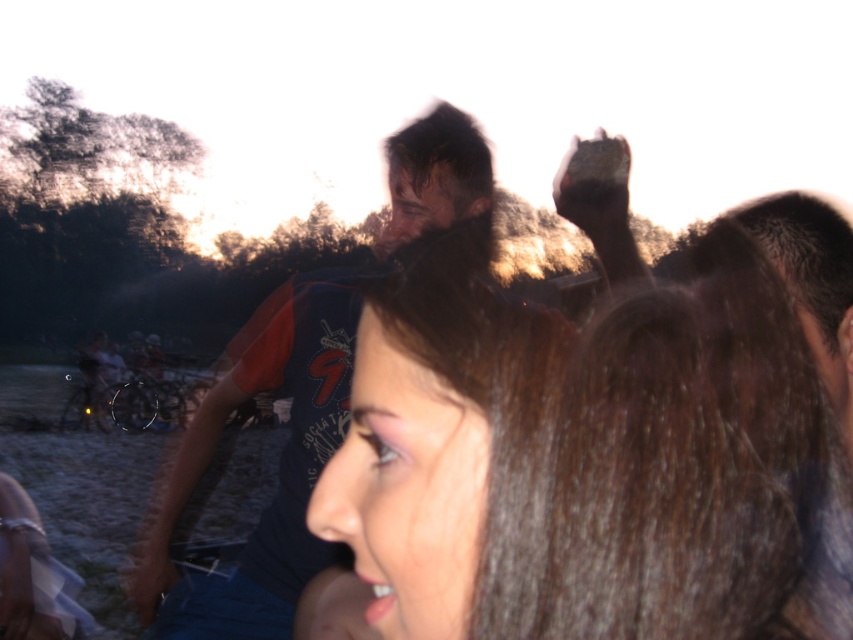
Can you confirm if brown hair at center is positioned to the left of dark blue t-shirt at upper center?

No, brown hair at center is not to the left of dark blue t-shirt at upper center.

How distant is brown hair at center from dark blue t-shirt at upper center?

brown hair at center and dark blue t-shirt at upper center are 30.39 inches apart from each other.

Between point (693, 524) and point (294, 374), which one is positioned behind?

The point (294, 374) is behind.

This screenshot has width=853, height=640. Find the location of `brown hair at center`. brown hair at center is located at coordinates (583, 458).